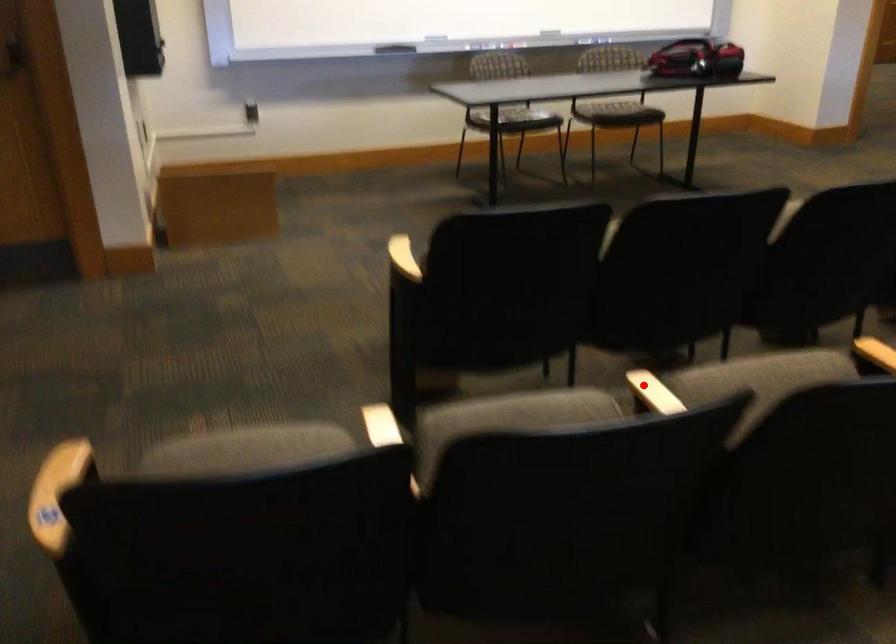
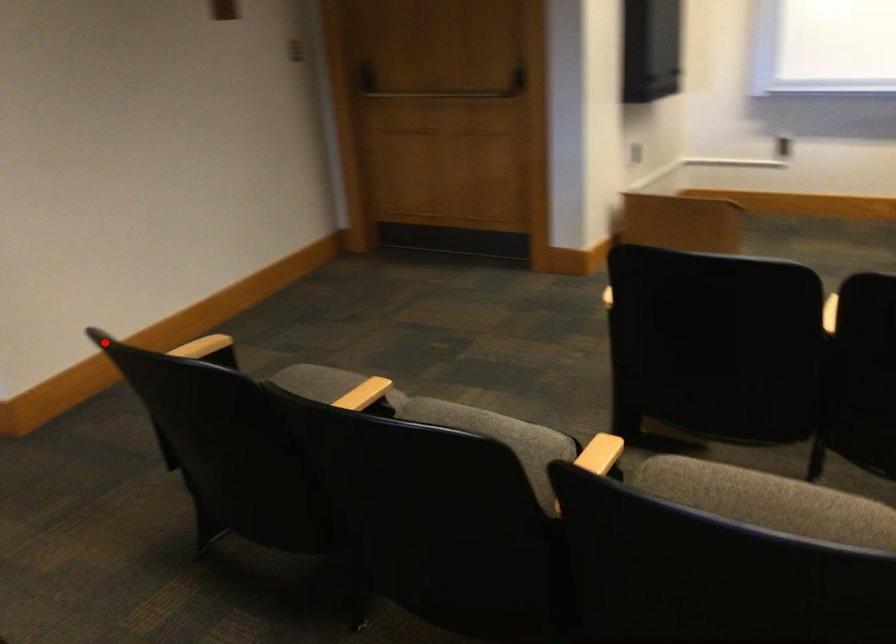
Consider the image. I am providing you with two images of the same scene from different viewpoints. A red point is marked on the first image and another point is marked on the second image. Is the red point in image1 aligned with the point shown in image2?

No